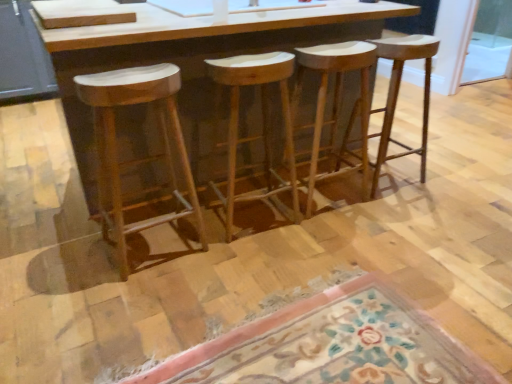
Question: Is natural wood stool at center, the fourth stool viewed from the left, wider than floral carpet at lower center?

Choices:
 (A) no
 (B) yes

Answer: (A)

Question: Is natural wood stool at center, the fourth stool viewed from the left, turned away from floral carpet at lower center?

Choices:
 (A) yes
 (B) no

Answer: (B)

Question: Is natural wood stool at center, the fourth stool viewed from the left, closer to the viewer compared to floral carpet at lower center?

Choices:
 (A) yes
 (B) no

Answer: (B)

Question: Considering the relative sizes of natural wood stool at center, the 1th stool from the right, and floral carpet at lower center in the image provided, is natural wood stool at center, the 1th stool from the right, smaller than floral carpet at lower center?

Choices:
 (A) yes
 (B) no

Answer: (B)

Question: Does natural wood stool at center, the 1th stool from the right, have a lesser width compared to floral carpet at lower center?

Choices:
 (A) no
 (B) yes

Answer: (B)

Question: Are natural wood stool at center, the 1th stool from the right, and floral carpet at lower center beside each other?

Choices:
 (A) yes
 (B) no

Answer: (B)

Question: Would you say natural wood stool at center, the fourth stool viewed from the left, is outside natural wood stool at left, which is counted as the fourth stool, starting from the right?

Choices:
 (A) yes
 (B) no

Answer: (A)

Question: From the image's perspective, would you say natural wood stool at center, the fourth stool viewed from the left, is shown under natural wood stool at left, arranged as the first stool when viewed from the left?

Choices:
 (A) yes
 (B) no

Answer: (B)

Question: Is natural wood stool at center, the 1th stool from the right, to the left of natural wood stool at left, which is counted as the fourth stool, starting from the right, from the viewer's perspective?

Choices:
 (A) yes
 (B) no

Answer: (B)

Question: Is natural wood stool at center, the fourth stool viewed from the left, bigger than natural wood stool at left, arranged as the first stool when viewed from the left?

Choices:
 (A) yes
 (B) no

Answer: (A)

Question: From the image's perspective, is natural wood stool at center, the 1th stool from the right, on natural wood stool at left, which is counted as the fourth stool, starting from the right?

Choices:
 (A) no
 (B) yes

Answer: (B)

Question: From a real-world perspective, is natural wood stool at center, the fourth stool viewed from the left, positioned over natural wood stool at left, arranged as the first stool when viewed from the left, based on gravity?

Choices:
 (A) yes
 (B) no

Answer: (B)

Question: Does natural wood stool at left, arranged as the first stool when viewed from the left, appear on the right side of natural wood stool at center, the 1th stool from the right?

Choices:
 (A) no
 (B) yes

Answer: (A)